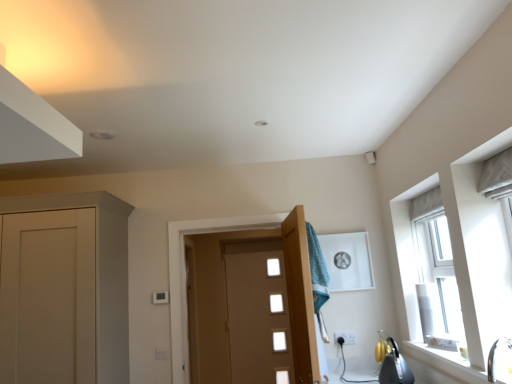
What are the coordinates of `white plastic electric outlet at lower center` in the screenshot? It's located at (346, 337).

What do you see at coordinates (395, 368) in the screenshot? The width and height of the screenshot is (512, 384). I see `metallic silver kettle at lower right` at bounding box center [395, 368].

In order to face teal fabric towel at center, should I rotate leftwards or rightwards?

It's best to rotate right around 8.663 degrees.

I want to click on wooden door at center, positioned as the first door in front-to-back order, so click(300, 297).

Image resolution: width=512 pixels, height=384 pixels. I want to click on matte brown door at center, arranged as the first door when viewed from the back, so click(258, 313).

Find the location of a particular element. Image resolution: width=512 pixels, height=384 pixels. white glossy sink at lower right is located at coordinates tap(500, 360).

You are a GUI agent. You are given a task and a screenshot of the screen. Output one action in this format:
    pyautogui.click(x=<x>, y=<y>)
    Task: Click on the white plastic electric outlet at lower center
    This screenshot has height=384, width=512.
    Given the screenshot: What is the action you would take?
    pyautogui.click(x=346, y=337)

From their relative heights in the image, would you say metallic silver kettle at lower right is taller or shorter than white glossy sink at lower right?

Considering their sizes, metallic silver kettle at lower right has more height than white glossy sink at lower right.

Who is bigger, metallic silver kettle at lower right or white glossy sink at lower right?

Bigger between the two is metallic silver kettle at lower right.

Is point (400, 375) closer to camera compared to point (490, 378)?

That is False.

Based on their positions, is white plastic electric outlet at lower center located to the left or right of white glossy sink at lower right?

From the image, it's evident that white plastic electric outlet at lower center is to the left of white glossy sink at lower right.

Does point (355, 338) come closer to viewer compared to point (509, 369)?

No.

Is white plastic electric outlet at lower center closer to camera compared to white glossy sink at lower right?

That is False.

Is matte brown door at center, the second door when ordered from front to back, to the left or to the right of metallic silver kettle at lower right in the image?

In the image, matte brown door at center, the second door when ordered from front to back, appears on the left side of metallic silver kettle at lower right.

Is point (276, 295) less distant than point (398, 373)?

No, it is not.

Based on the photo, between matte brown door at center, arranged as the first door when viewed from the back, and metallic silver kettle at lower right, which one has larger width?

metallic silver kettle at lower right.

Is matte brown door at center, the second door when ordered from front to back, situated inside metallic silver kettle at lower right or outside?

matte brown door at center, the second door when ordered from front to back, is not enclosed by metallic silver kettle at lower right.

From the image's perspective, is wooden door at center, the second door from the back, located beneath teal fabric towel at center?

Yes, from the image's perspective, wooden door at center, the second door from the back, is beneath teal fabric towel at center.

Is wooden door at center, the second door from the back, shorter than teal fabric towel at center?

No, wooden door at center, the second door from the back, is not shorter than teal fabric towel at center.

Is point (303, 366) positioned behind point (321, 254)?

No.

Identify the location of laundry positioned vertically above the wooden door at center, the second door from the back (from a real-world perspective). The width and height of the screenshot is (512, 384). (318, 278).

Is white ceramic window sill at lower right smaller than white plastic electric outlet at lower center?

No.

What's the angular difference between white ceramic window sill at lower right and white plastic electric outlet at lower center's facing directions?

89.5 degrees.

Do you think white ceramic window sill at lower right is within white plastic electric outlet at lower center, or outside of it?

white ceramic window sill at lower right is located beyond the bounds of white plastic electric outlet at lower center.

Considering the sizes of objects white plastic electric outlet at lower center and teal fabric towel at center in the image provided, who is wider, white plastic electric outlet at lower center or teal fabric towel at center?

With larger width is teal fabric towel at center.

Between white plastic electric outlet at lower center and teal fabric towel at center, which one has smaller size?

With smaller size is white plastic electric outlet at lower center.

Which is more to the left, white plastic electric outlet at lower center or teal fabric towel at center?

From the viewer's perspective, teal fabric towel at center appears more on the left side.

Is the surface of white plastic electric outlet at lower center in direct contact with teal fabric towel at center?

No, white plastic electric outlet at lower center is not next to teal fabric towel at center.

Is white ceramic window sill at lower right with matte brown door at center, the second door when ordered from front to back?

No, white ceramic window sill at lower right is not next to matte brown door at center, the second door when ordered from front to back.

Which door is the 2nd one when counting from the left side of the white ceramic window sill at lower right? Please provide its 2D coordinates.

[(258, 313)]

From a real-world perspective, between white ceramic window sill at lower right and matte brown door at center, the second door when ordered from front to back, who is vertically lower?

white ceramic window sill at lower right.

Is white ceramic window sill at lower right taller or shorter than matte brown door at center, the second door when ordered from front to back?

Considering their sizes, white ceramic window sill at lower right has less height than matte brown door at center, the second door when ordered from front to back.

The height and width of the screenshot is (384, 512). Find the location of `sink positioned vertically above the metallic silver kettle at lower right (from a real-world perspective)`. sink positioned vertically above the metallic silver kettle at lower right (from a real-world perspective) is located at coordinates (500, 360).

This screenshot has width=512, height=384. What are the coordinates of `electric outlet behind the white glossy sink at lower right` in the screenshot? It's located at (346, 337).

Which object lies further to the anchor point teal fabric towel at center, metallic silver kettle at lower right or matte brown door at center, the second door when ordered from front to back?

matte brown door at center, the second door when ordered from front to back.

When comparing their distances from white ceramic window sill at lower right, does white plastic electric outlet at lower center or matte brown door at center, the second door when ordered from front to back, seem closer?

white plastic electric outlet at lower center.

From the picture: Based on their spatial positions, is white glossy sink at lower right or white ceramic window sill at lower right closer to white plastic electric outlet at lower center?

white ceramic window sill at lower right is positioned closer to the anchor white plastic electric outlet at lower center.

Based on their spatial positions, is white glossy sink at lower right or metallic silver kettle at lower right further from white plastic electric outlet at lower center?

Based on the image, white glossy sink at lower right appears to be further to white plastic electric outlet at lower center.

Which object lies further to the anchor point teal fabric towel at center, wooden door at center, positioned as the first door in front-to-back order, or metallic silver kettle at lower right?

metallic silver kettle at lower right.

Estimate the real-world distances between objects in this image. Which object is closer to wooden door at center, positioned as the first door in front-to-back order, matte brown door at center, arranged as the first door when viewed from the back, or metallic silver kettle at lower right?

The object closer to wooden door at center, positioned as the first door in front-to-back order, is metallic silver kettle at lower right.

Looking at the image, which one is located further to white ceramic window sill at lower right, teal fabric towel at center or white glossy sink at lower right?

teal fabric towel at center lies further to white ceramic window sill at lower right than the other object.

Considering their positions, is metallic silver kettle at lower right positioned closer to teal fabric towel at center than white glossy sink at lower right?

metallic silver kettle at lower right is positioned closer to the anchor teal fabric towel at center.

Locate an element on the screen. The image size is (512, 384). window sill between white glossy sink at lower right and matte brown door at center, the second door when ordered from front to back, from front to back is located at coordinates (445, 362).

Identify the location of electric outlet located between white ceramic window sill at lower right and matte brown door at center, arranged as the first door when viewed from the back, in the depth direction. Image resolution: width=512 pixels, height=384 pixels. (346, 337).

Where is `laundry between metallic silver kettle at lower right and white plastic electric outlet at lower center from front to back`? Image resolution: width=512 pixels, height=384 pixels. laundry between metallic silver kettle at lower right and white plastic electric outlet at lower center from front to back is located at coordinates (318, 278).

What are the coordinates of `appliance between wooden door at center, positioned as the first door in front-to-back order, and white plastic electric outlet at lower center in the front-back direction` in the screenshot? It's located at (395, 368).